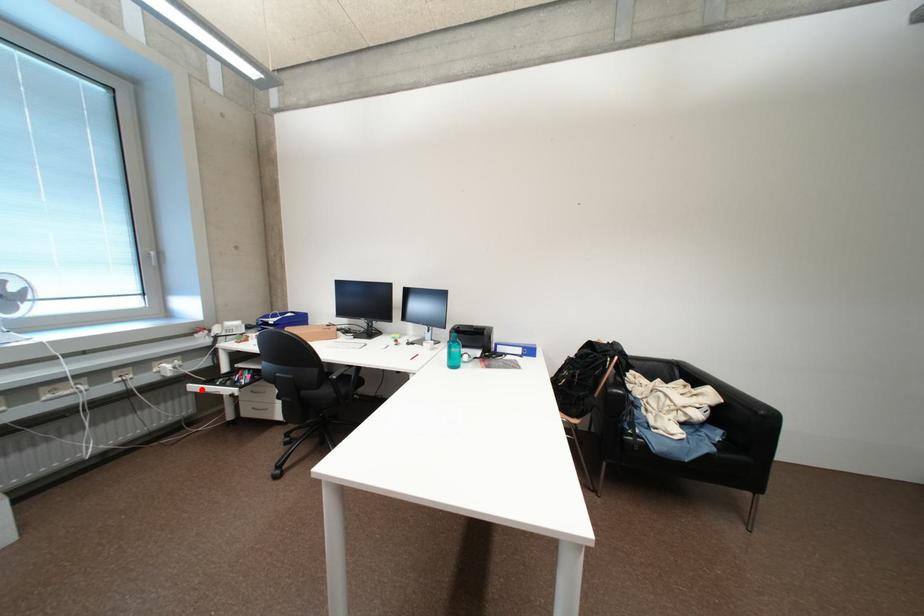
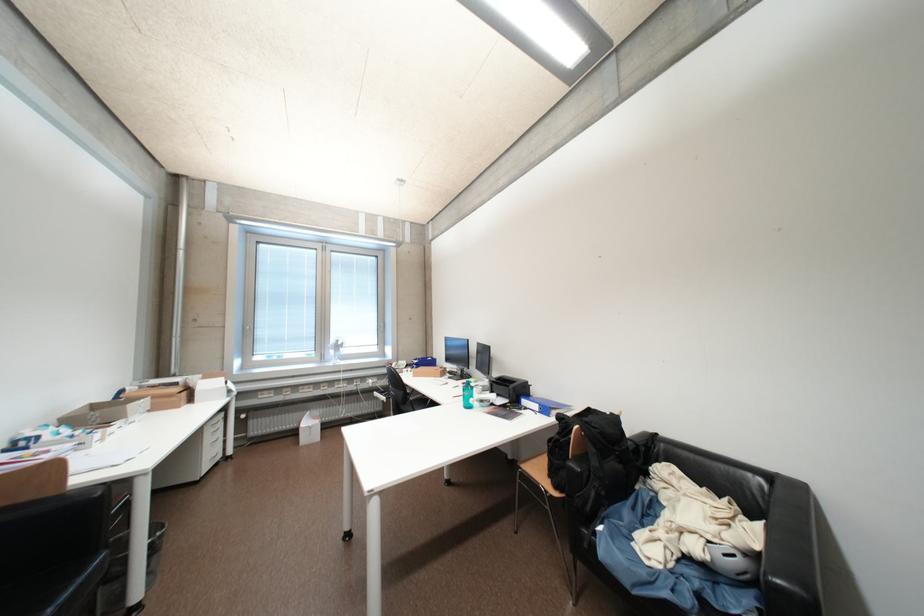
Question: I am providing you with two images of the same scene from different viewpoints. Given a red point in image1, look at the same physical point in image2. Is it:

Choices:
 (A) Closer to the viewpoint
 (B) Farther from the viewpoint

Answer: (B)